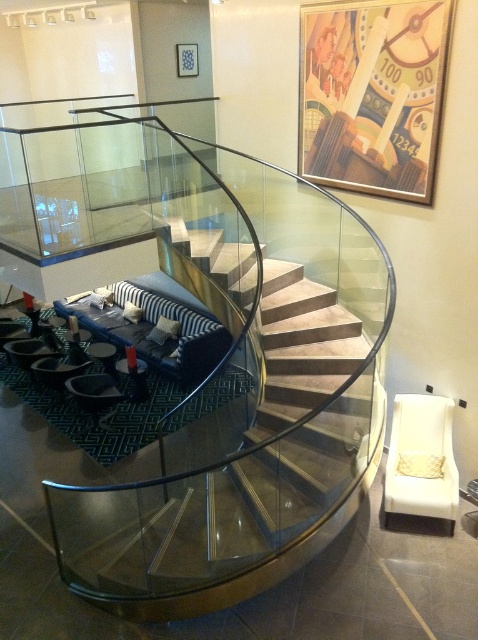
You are planning to rearrange furniture in the room and need to know which object takes up more floor space. Which one is larger in size between the clear glass staircase at center and the transparent glass table at lower left?

The transparent glass table at lower left occupies more space than the clear glass staircase at center.

You are a delivery person carrying a large package that requires a clear path to the front desk located near the clear glass staircase at center. The transparent glass table at lower left is currently blocking your path. Can you move the table to create enough space to reach the staircase?

The clear glass staircase at center is 3.67 meters away from the transparent glass table at lower left. Since the table is blocking your path, moving it would create sufficient space to reach the staircase as the distance between them allows for maneuvering around the obstruction.

You are planning to place a heavy potted plant on the transparent glass table at lower left. Considering the clear glass staircase at center is directly below it, is there a risk of the staircase being damaged if the table breaks?

The clear glass staircase at center is positioned under the transparent glass table at lower left. If the table were to break, the staircase could be damaged due to its location directly beneath the table.